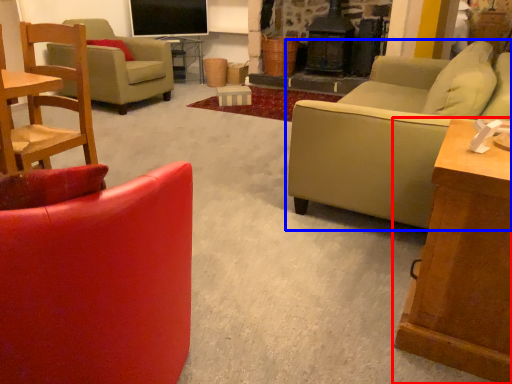
Question: Among these objects, which one is nearest to the camera, table (highlighted by a red box) or studio couch (highlighted by a blue box)?

Choices:
 (A) table
 (B) studio couch

Answer: (A)